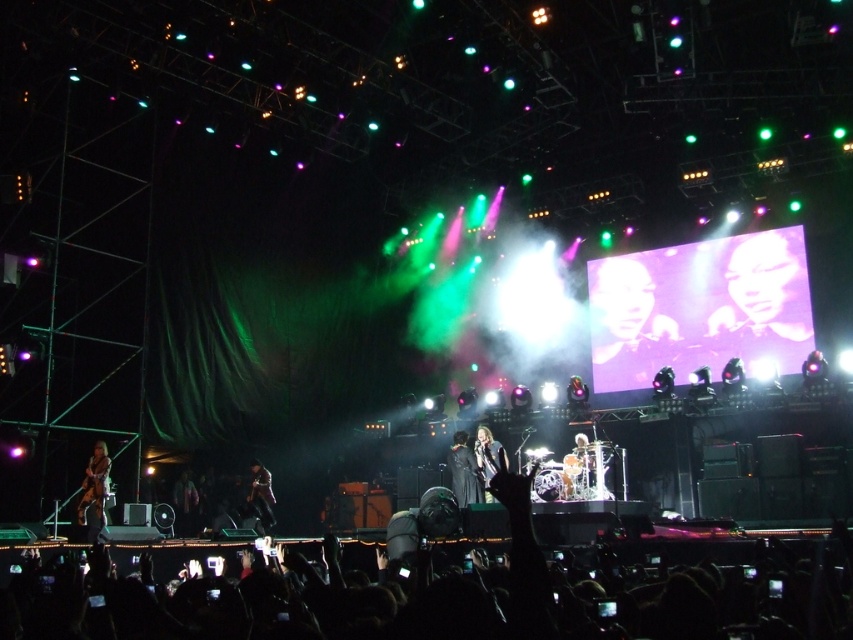
You are a photographer at the concert and want to capture both the shiny silver drum set at center and the dark gray fabric jacket at center in a single shot. Since you can only focus on one object at a time, which object should you focus on to ensure the other is still in the background?

Since the shiny silver drum set at center is not as tall as the dark gray fabric jacket at center, you should focus on the dark gray fabric jacket at center to ensure the shiny silver drum set at center is visible in the background.

You are a photographer at the concert and want to capture a photo that includes both the smooth skin face at upper right and the shiny black guitar at lower left. Given that your camera has a maximum focus range of 30 meters, will you be able to capture both subjects in focus?

The smooth skin face at upper right is 38.89 meters away from the shiny black guitar at lower left. Since the distance between them exceeds the camera maximum focus range of 30 meters, you won not be able to capture both subjects in focus.

You are a photographer at the concert and want to capture the smooth skin face at upper right. Where exactly should you aim your camera?

You should aim your camera at point (766, 285) to capture the smooth skin face at upper right.